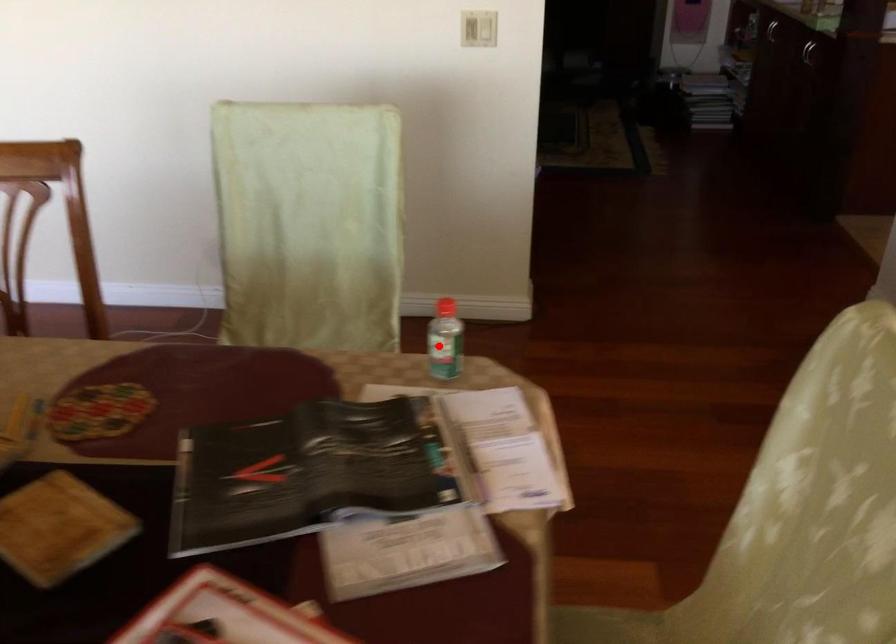
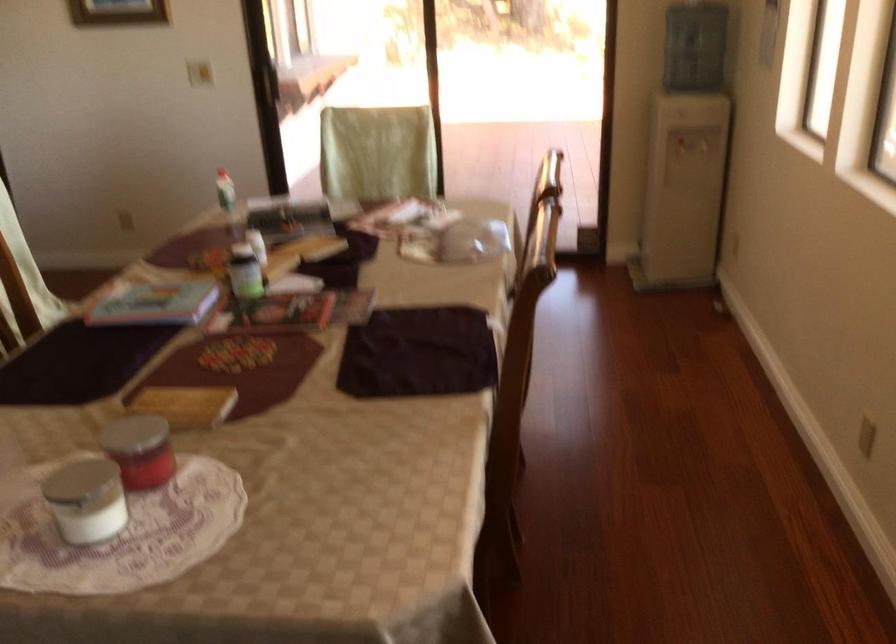
Question: I am providing you with two images of the same scene from different viewpoints. Image1 has a red point marked. In image2, the corresponding 3D location appears at what relative position? Reply with the corresponding letter.

Choices:
 (A) Closer
 (B) Farther

Answer: (B)